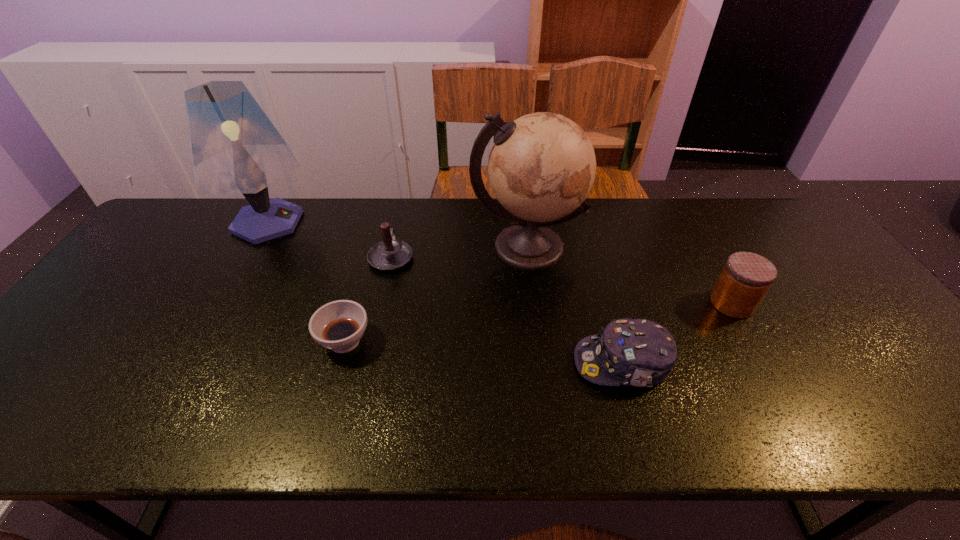
You are a GUI agent. You are given a task and a screenshot of the screen. Output one action in this format:
    pyautogui.click(x=<x>, y=<y>)
    Task: Click on the free space located on the side of the candle with the handle loop
    The width and height of the screenshot is (960, 540).
    Given the screenshot: What is the action you would take?
    pyautogui.click(x=398, y=225)

Find the location of a particular element. The width and height of the screenshot is (960, 540). free space located on the side of the candle with the handle loop is located at coordinates (403, 200).

In order to click on free space located on the side of the candle with the handle loop in this screenshot , I will do `click(401, 208)`.

I want to click on vacant space located 0.070m on the front-facing side of the fifth tallest object, so click(x=544, y=363).

The width and height of the screenshot is (960, 540). I want to click on vacant area situated 0.270m on the front-facing side of the fifth tallest object, so click(458, 363).

At what (x,y) coordinates should I click in order to perform the action: click on vacant region located 0.080m on the front-facing side of the fifth tallest object. Please return your answer as a coordinate pair (x, y). Looking at the image, I should click on (540, 363).

At what (x,y) coordinates should I click in order to perform the action: click on blank space located on the left of the shortest object. Please return your answer as a coordinate pair (x, y). The image size is (960, 540). Looking at the image, I should click on (260, 341).

Where is `lampshade at the far edge`? lampshade at the far edge is located at coordinates (234, 147).

Identify the location of globe located at the far edge. (541, 168).

Where is `candle that is at the far edge`? candle that is at the far edge is located at coordinates (390, 254).